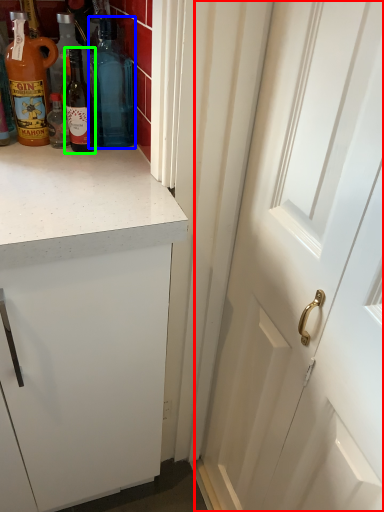
Question: Which is farther away from door (highlighted by a red box)? bottle (highlighted by a blue box) or bottle (highlighted by a green box)?

Choices:
 (A) bottle
 (B) bottle

Answer: (B)